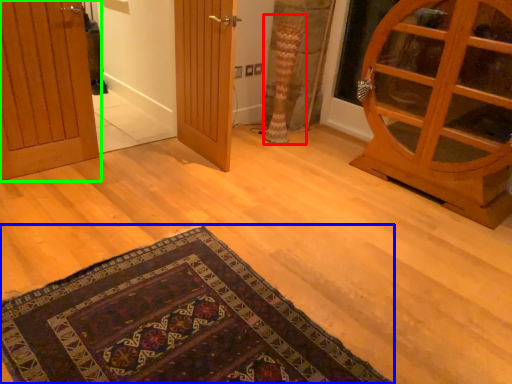
Question: Which object is the farthest from curtain (highlighted by a red box)? Choose among these: mat (highlighted by a blue box) or door (highlighted by a green box).

Choices:
 (A) mat
 (B) door

Answer: (A)